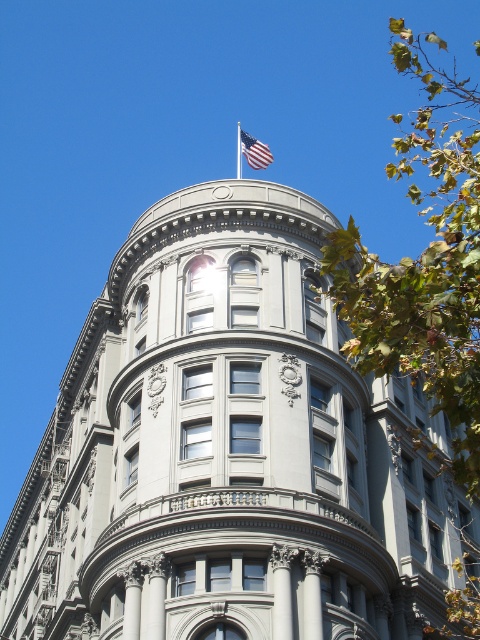
Question: Which point appears closest to the camera in this image?

Choices:
 (A) (237, 164)
 (B) (98, 522)
 (C) (252, 164)

Answer: (B)

Question: Does american flag at top have a lesser width compared to silver metallic flag pole at upper center?

Choices:
 (A) yes
 (B) no

Answer: (B)

Question: Can you confirm if american flag at top is positioned below silver metallic flag pole at upper center?

Choices:
 (A) no
 (B) yes

Answer: (B)

Question: Which of the following is the farthest from the observer?

Choices:
 (A) (252, 150)
 (B) (128, 634)

Answer: (A)

Question: Is american flag at top to the left of silver metallic flag pole at upper center from the viewer's perspective?

Choices:
 (A) no
 (B) yes

Answer: (A)

Question: Estimate the real-world distances between objects in this image. Which object is closer to the gray stone tower at center?

Choices:
 (A) american flag at top
 (B) silver metallic flag pole at upper center

Answer: (A)